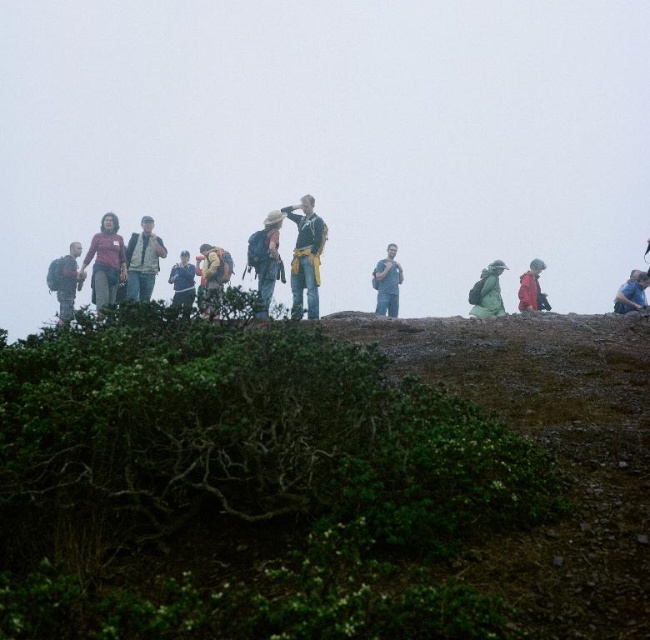
Which is below, blue jeans at center or green matte jacket at center-right?

green matte jacket at center-right is lower down.

Does blue jeans at center have a lesser height compared to green matte jacket at center-right?

In fact, blue jeans at center may be taller than green matte jacket at center-right.

Where is `blue jeans at center`? The height and width of the screenshot is (640, 650). blue jeans at center is located at coordinates (387, 284).

Find the location of a particular element. The width and height of the screenshot is (650, 640). blue jeans at center is located at coordinates (387, 284).

Between green leafy bush at center and dark blue jacket at center, which one is positioned lower?

green leafy bush at center is lower down.

Does green leafy bush at center have a larger size compared to dark blue jacket at center?

Incorrect, green leafy bush at center is not larger than dark blue jacket at center.

Measure the distance between point (442, 528) and camera.

The distance of point (442, 528) from camera is 4.66 meters.

Locate an element on the screen. green leafy bush at center is located at coordinates (356, 452).

The width and height of the screenshot is (650, 640). Find the location of `red matte jacket at center`. red matte jacket at center is located at coordinates (530, 289).

Which is above, red matte jacket at center or blue fabric jacket at right?

blue fabric jacket at right is higher up.

Image resolution: width=650 pixels, height=640 pixels. What do you see at coordinates (530, 289) in the screenshot?
I see `red matte jacket at center` at bounding box center [530, 289].

You are a GUI agent. You are given a task and a screenshot of the screen. Output one action in this format:
    pyautogui.click(x=<x>, y=<y>)
    Task: Click on the red matte jacket at center
    
    Given the screenshot: What is the action you would take?
    pyautogui.click(x=530, y=289)